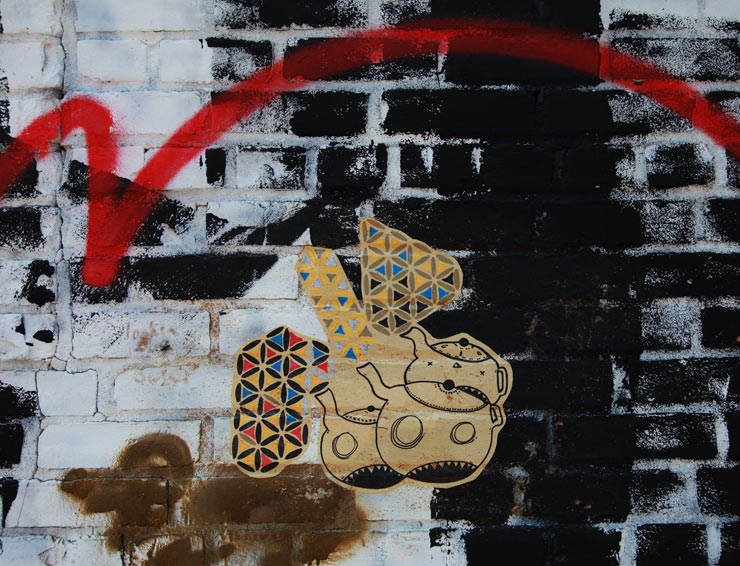
Where is `teapots`? The height and width of the screenshot is (566, 740). teapots is located at coordinates [336, 444], [436, 451], [479, 363].